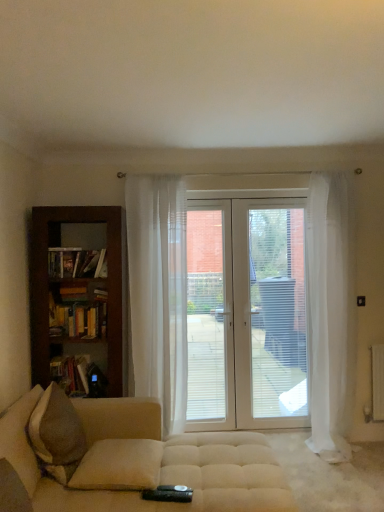
Question: From the image's perspective, is dark wood bookcase at left below hardcover book at left, the second book positioned from the top?

Choices:
 (A) yes
 (B) no

Answer: (B)

Question: Does dark wood bookcase at left appear on the right side of hardcover book at left, which is counted as the first book, starting from the bottom?

Choices:
 (A) yes
 (B) no

Answer: (A)

Question: Considering the relative sizes of dark wood bookcase at left and hardcover book at left, which is counted as the first book, starting from the bottom, in the image provided, is dark wood bookcase at left shorter than hardcover book at left, which is counted as the first book, starting from the bottom,?

Choices:
 (A) no
 (B) yes

Answer: (A)

Question: From a real-world perspective, is dark wood bookcase at left on top of hardcover book at left, the second book positioned from the top?

Choices:
 (A) no
 (B) yes

Answer: (B)

Question: Does dark wood bookcase at left lie behind hardcover book at left, which is counted as the first book, starting from the bottom?

Choices:
 (A) yes
 (B) no

Answer: (B)

Question: In terms of height, does beige fabric studio couch at lower left look taller or shorter compared to white glossy door at center?

Choices:
 (A) tall
 (B) short

Answer: (B)

Question: Looking at the image, does beige fabric studio couch at lower left seem bigger or smaller compared to white glossy door at center?

Choices:
 (A) big
 (B) small

Answer: (A)

Question: From the image's perspective, relative to white glossy door at center, is beige fabric studio couch at lower left above or below?

Choices:
 (A) below
 (B) above

Answer: (A)

Question: Is point (218, 504) positioned closer to the camera than point (271, 409)?

Choices:
 (A) farther
 (B) closer

Answer: (B)

Question: Is hardcover book at left, which is counted as the first book, starting from the bottom, taller or shorter than sheer white curtain at center, the 2th curtain in the right-to-left sequence?

Choices:
 (A) tall
 (B) short

Answer: (B)

Question: Considering the positions of point (57, 370) and point (175, 181), is point (57, 370) closer or farther from the camera than point (175, 181)?

Choices:
 (A) closer
 (B) farther

Answer: (A)

Question: Considering the positions of hardcover book at left, the second book positioned from the top, and sheer white curtain at center, which appears as the 1th curtain when viewed from the left, in the image, is hardcover book at left, the second book positioned from the top, bigger or smaller than sheer white curtain at center, which appears as the 1th curtain when viewed from the left,?

Choices:
 (A) small
 (B) big

Answer: (A)

Question: From the image's perspective, relative to sheer white curtain at center, the 2th curtain in the right-to-left sequence, is hardcover book at left, which is counted as the first book, starting from the bottom, above or below?

Choices:
 (A) above
 (B) below

Answer: (B)

Question: From a real-world perspective, is beige fabric studio couch at lower left physically located above or below sheer white curtain at center, the 2th curtain in the right-to-left sequence?

Choices:
 (A) below
 (B) above

Answer: (A)

Question: In the image, is beige fabric studio couch at lower left positioned in front of or behind sheer white curtain at center, the 2th curtain in the right-to-left sequence?

Choices:
 (A) front
 (B) behind

Answer: (A)